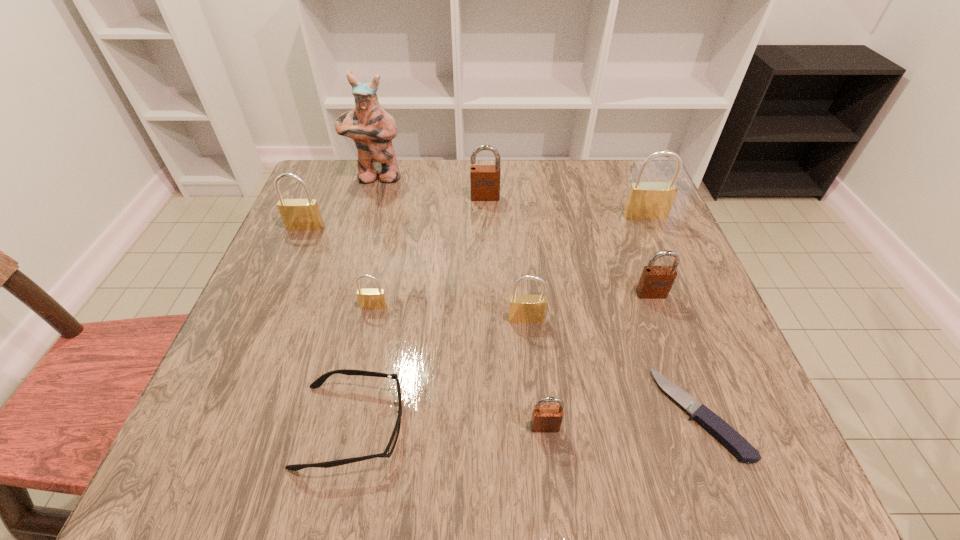
Find the location of a particular element. Image resolution: width=960 pixels, height=540 pixels. vacant area that lies between the shortest object and the nearest padlock is located at coordinates (622, 420).

Identify the location of free point between the spectacles and the sixth nearest object. (501, 360).

At what (x,y) coordinates should I click in order to perform the action: click on vacant area that lies between the second brass padlock from right to left and the smallest brass padlock. Please return your answer as a coordinate pair (x, y). This screenshot has height=540, width=960. Looking at the image, I should click on (450, 313).

At what (x,y) coordinates should I click in order to perform the action: click on vacant area between the leftmost object and the seventh farthest object. Please return your answer as a coordinate pair (x, y). The height and width of the screenshot is (540, 960). Looking at the image, I should click on (416, 273).

Point out which object is positioned as the seventh nearest to the spectacles. Please provide its 2D coordinates. Your answer should be formatted as a tuple, i.e. [(x, y)], where the tuple contains the x and y coordinates of a point satisfying the conditions above.

[(484, 179)]

Find the location of a particular element. object that is the nearest to the tallest object is located at coordinates (297, 214).

You are a GUI agent. You are given a task and a screenshot of the screen. Output one action in this format:
    pyautogui.click(x=<x>, y=<y>)
    Task: Click on the padlock that is the third closest to the second smallest brass padlock
    
    Given the screenshot: What is the action you would take?
    pyautogui.click(x=370, y=298)

Locate which padlock ranks third in proximity to the shortest object. Please provide its 2D coordinates. Your answer should be formatted as a tuple, i.e. [(x, y)], where the tuple contains the x and y coordinates of a point satisfying the conditions above.

[(527, 308)]

Choose which brass padlock is the second nearest neighbor to the second tallest object. Please provide its 2D coordinates. Your answer should be formatted as a tuple, i.e. [(x, y)], where the tuple contains the x and y coordinates of a point satisfying the conditions above.

[(370, 298)]

Identify which brass padlock is the third nearest to the fifth padlock from right to left. Please provide its 2D coordinates. Your answer should be formatted as a tuple, i.e. [(x, y)], where the tuple contains the x and y coordinates of a point satisfying the conditions above.

[(527, 308)]